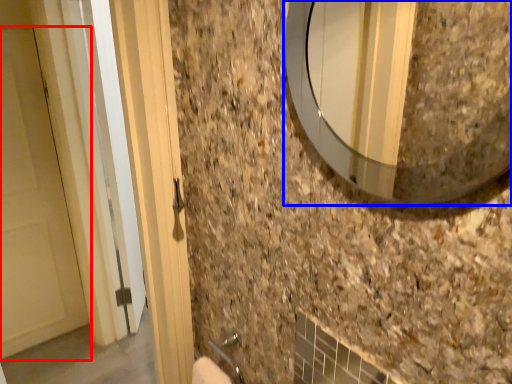
Question: Which point is closer to the camera, door (highlighted by a red box) or mirror (highlighted by a blue box)?

Choices:
 (A) door
 (B) mirror

Answer: (B)